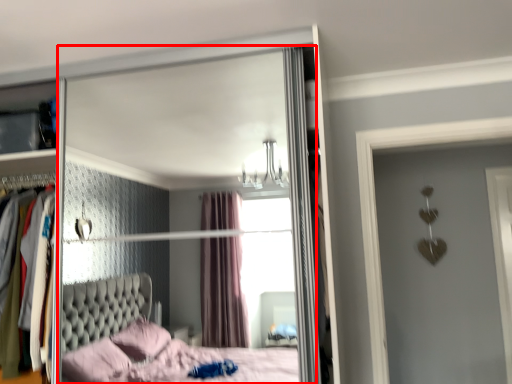
Question: From the image, what is the correct spatial relationship of mirror (annotated by the red box) in relation to dresser?

Choices:
 (A) right
 (B) left

Answer: (A)